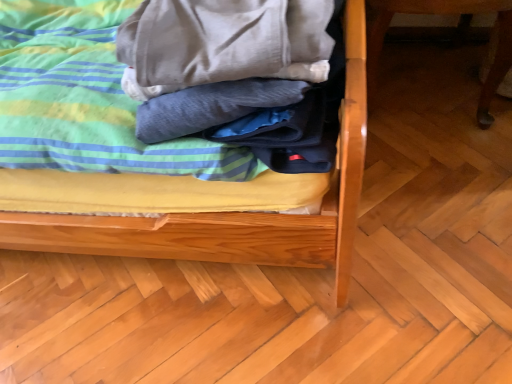
Find the location of `free location in front of wooden table leg at right`. free location in front of wooden table leg at right is located at coordinates (436, 183).